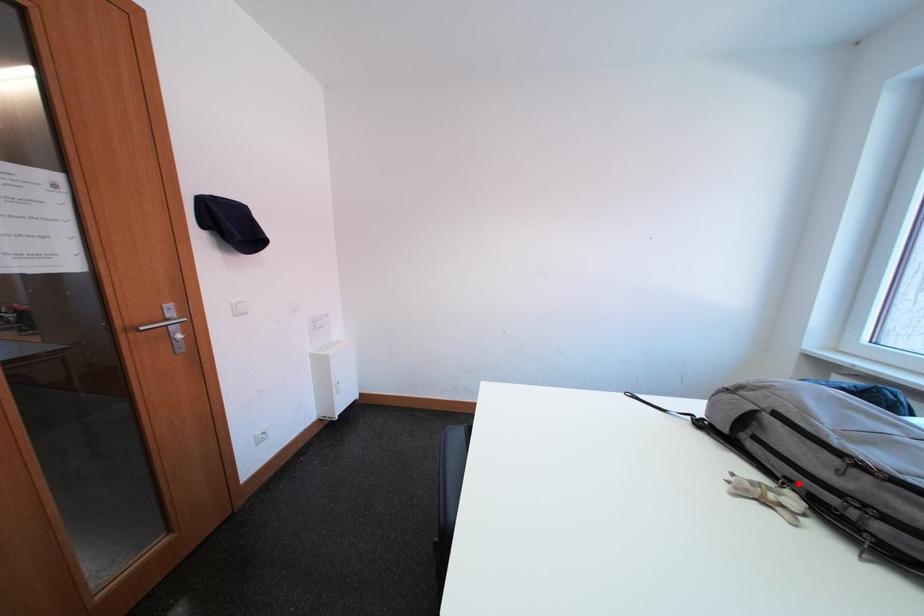
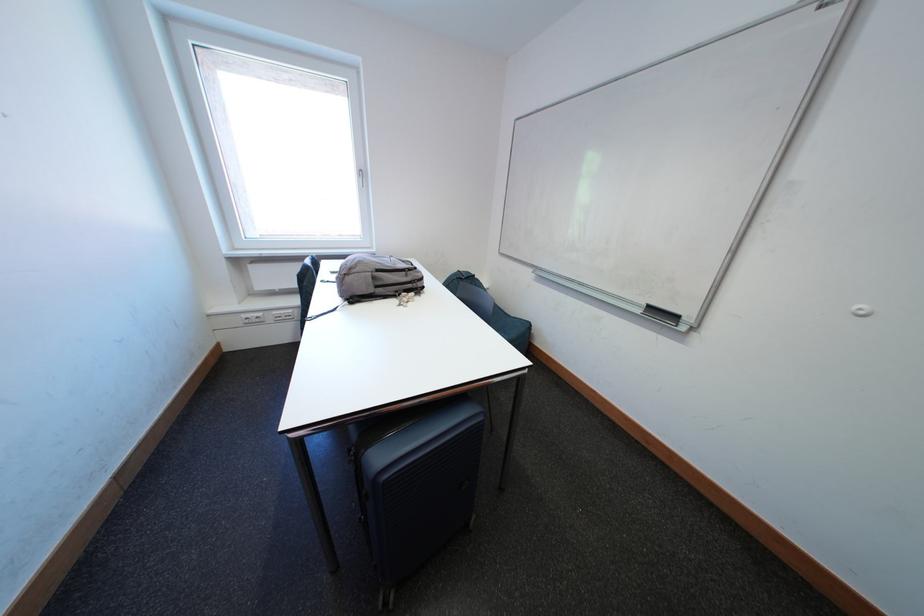
Question: I am providing you with two images of the same scene from different viewpoints. A red point is marked on the first image. At the location where the point appears in image 1, is it still visible in image 2?

Choices:
 (A) Yes
 (B) No

Answer: (A)